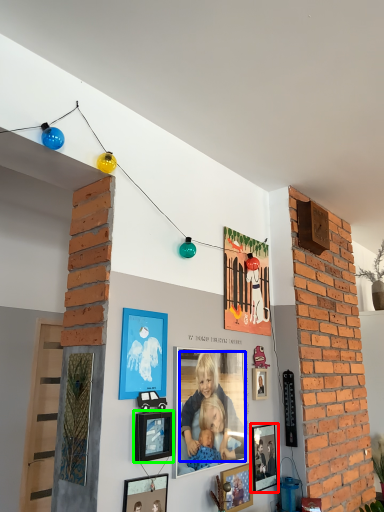
Question: Considering the real-world distances, which object is farthest from picture frame (highlighted by a red box)? person (highlighted by a blue box) or picture frame (highlighted by a green box)?

Choices:
 (A) person
 (B) picture frame

Answer: (B)